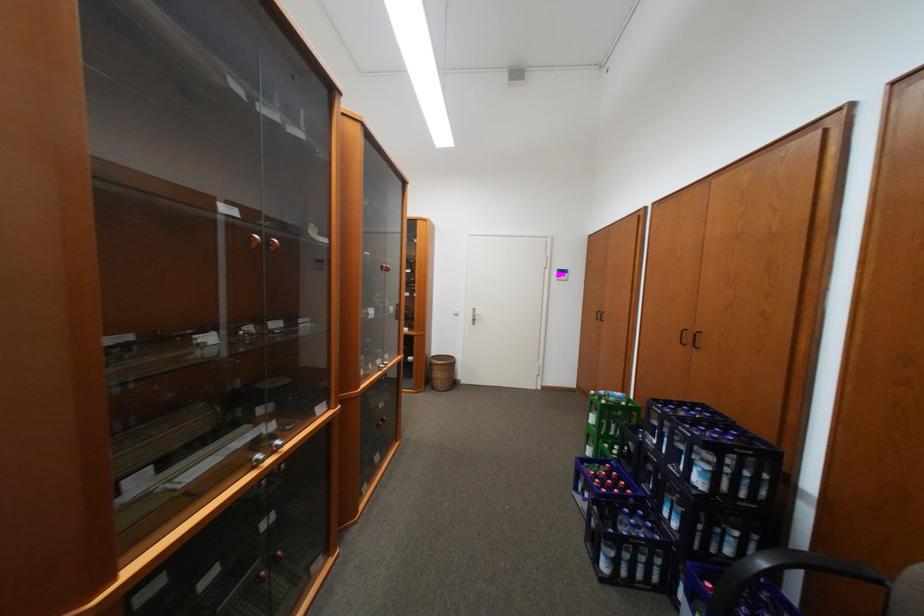
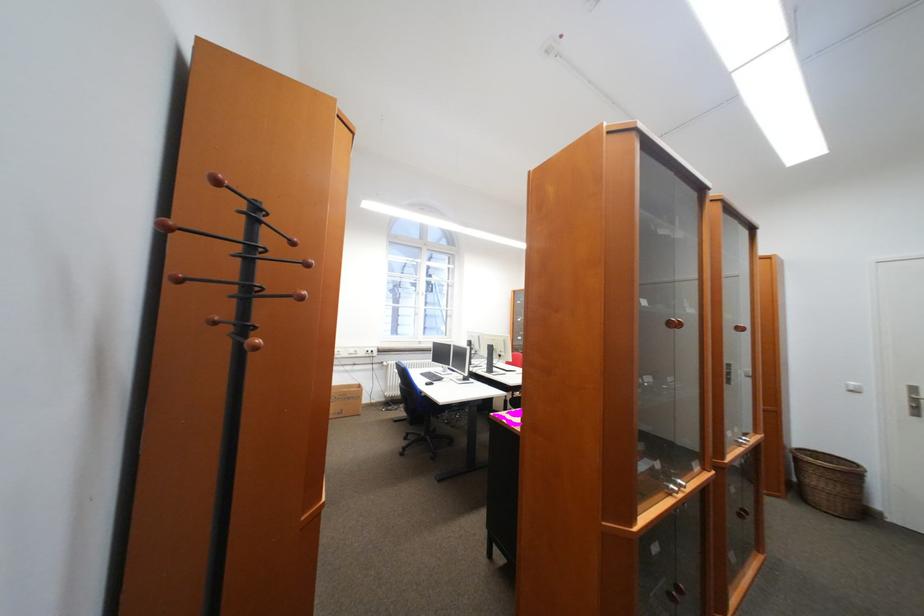
Find the pixel in the second image that matches the point at 447,384 in the first image.

(830, 499)